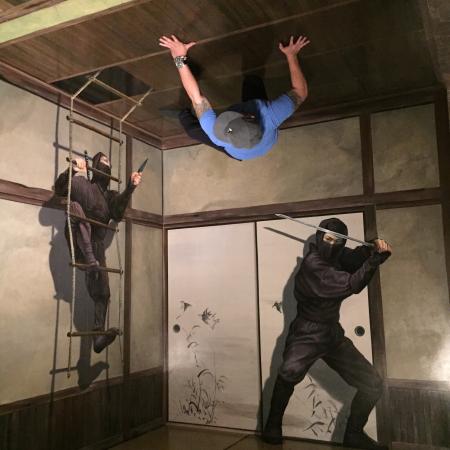
This screenshot has height=450, width=450. What are the coordinates of `white wall` in the screenshot? It's located at (25, 300), (424, 304), (217, 182), (29, 162), (409, 162).